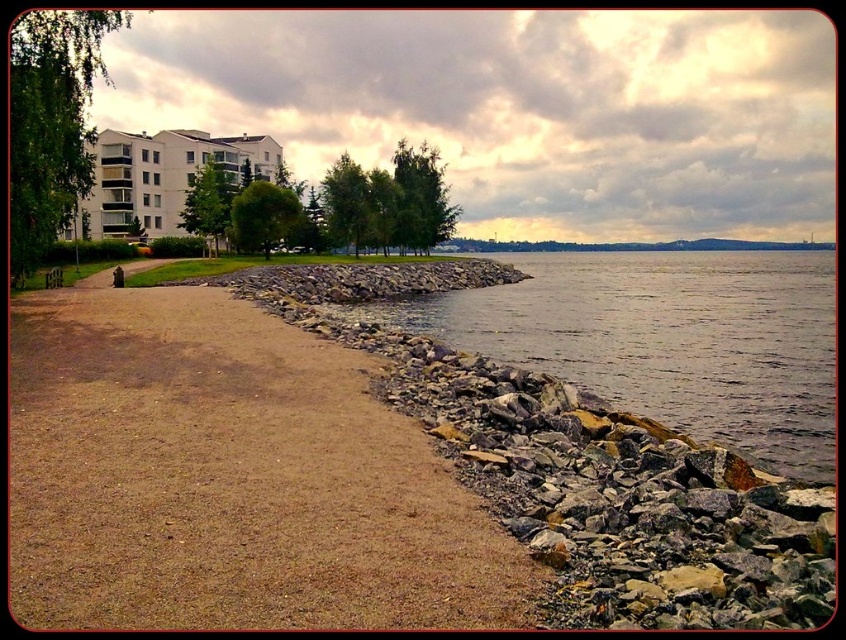
Between point (50, 340) and point (825, 272), which one is positioned in front?

Positioned in front is point (50, 340).

Who is positioned more to the right, brown gravel path at lower left or grayish water at lower right?

From the viewer's perspective, grayish water at lower right appears more on the right side.

Identify the location of brown gravel path at lower left. This screenshot has width=846, height=640. (229, 477).